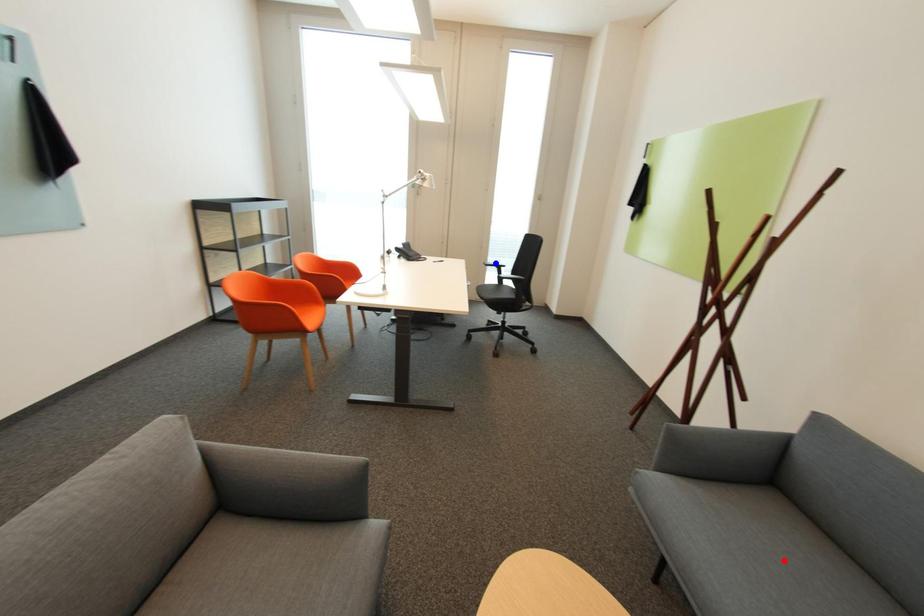
Question: Which of the two points in the image is closer to the camera?

Choices:
 (A) Blue point is closer.
 (B) Red point is closer.

Answer: (B)